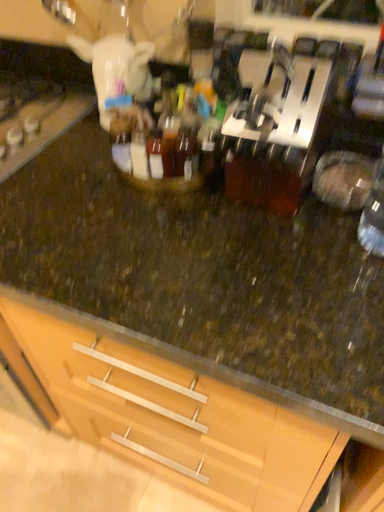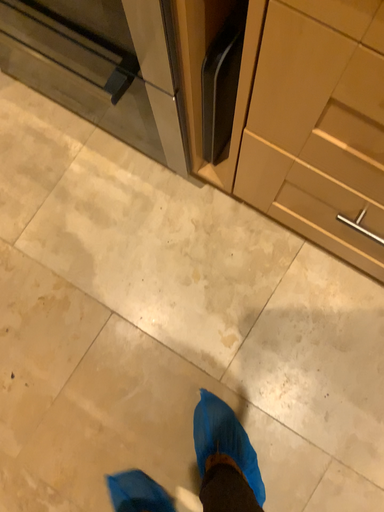
Question: How did the camera likely rotate when shooting the video?

Choices:
 (A) rotated downward
 (B) rotated upward

Answer: (A)